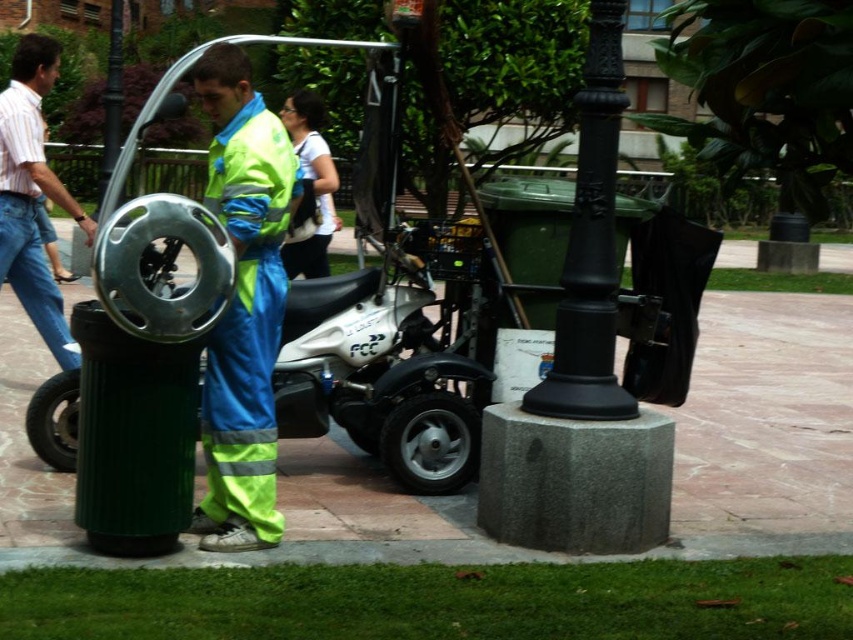
You are a delivery driver who needs to park your 2.5 meter long van behind the white matte motorcycle at center. Is there enough space for the van to park behind the motorcycle without moving it?

The distance between the white matte motorcycle at center and the camera is 6.60 meters. Since the van is 2.5 meters long, there is sufficient space to park behind the motorcycle as 6.60 meters is greater than 2.5 meters.

You are a delivery person who needs to load a package onto the white matte motorcycle at center. The package requires a minimum of 10 inches of space between the loading area and the black rubber tire at lower center. Can you fit the package on the motorcycle?

The white matte motorcycle at center is only 7.26 inches from the black rubber tire at lower center, which is less than the required 10 inches. Therefore, the package cannot be safely loaded onto the motorcycle.

In the scene shown: You are a delivery person who needs to check the size of the high visibility fabric jumpsuit at center and the black rubber tire at lower left. Which one is larger?

The high visibility fabric jumpsuit at center is bigger than the black rubber tire at lower left according to the description.